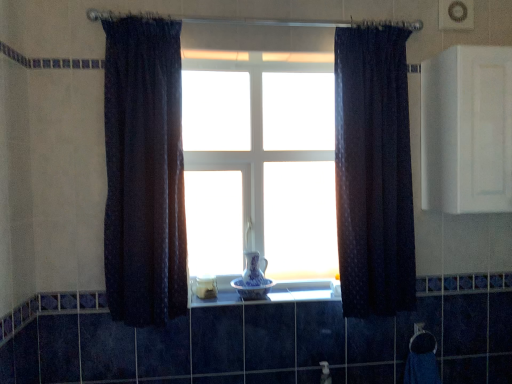
The height and width of the screenshot is (384, 512). Find the location of `free point above blue porcelain vase at center, the 2th glass vase positioned from the top (from a real-world perspective)`. free point above blue porcelain vase at center, the 2th glass vase positioned from the top (from a real-world perspective) is located at coordinates (253, 280).